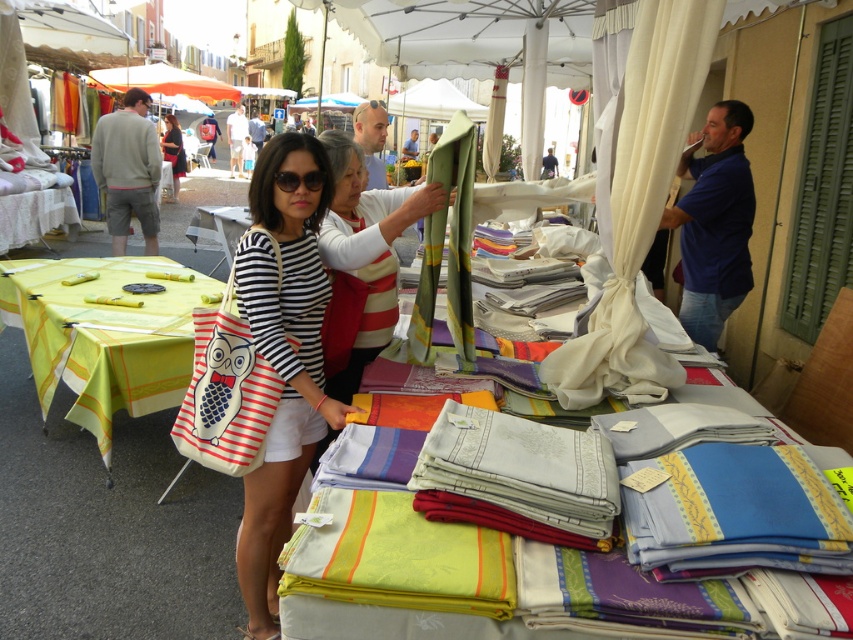
You are a customer at the market and see both the striped cotton bag at center and the striped fabric bag at center. Which one is positioned lower in the image?

The striped cotton bag at center is positioned lower than the striped fabric bag at center.

Looking at this image, you are a customer at the market and want to know which item is taller between the gray cotton shorts at left and the green fabric at center. Can you determine this based on their positions?

The gray cotton shorts at left has a greater height compared to the green fabric at center, so the gray cotton shorts at left is taller.